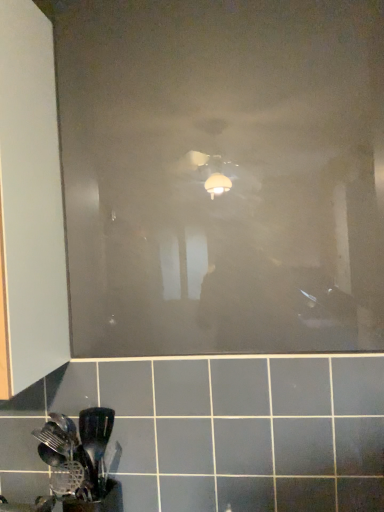
Describe the element at coordinates (76, 455) in the screenshot. The image size is (384, 512). I see `black plastic spatula at lower left` at that location.

Describe the element at coordinates (30, 203) in the screenshot. I see `matte white cabinet at left` at that location.

Where is `transparent matte glass door at center`? transparent matte glass door at center is located at coordinates (222, 174).

Locate an element on the screen. This screenshot has width=384, height=512. black plastic spatula at lower left is located at coordinates (76, 455).

Which is more to the left, matte white cabinet at left or black plastic spatula at lower left?

From the viewer's perspective, matte white cabinet at left appears more on the left side.

Identify the location of cabinetry that is in front of the black plastic spatula at lower left. This screenshot has width=384, height=512. (30, 203).

From a real-world perspective, which object stands above the other?

matte white cabinet at left.

Is matte white cabinet at left placed right next to black plastic spatula at lower left?

matte white cabinet at left and black plastic spatula at lower left are not in contact.

How many degrees apart are the facing directions of matte white cabinet at left and transparent matte glass door at center?

The angular difference between matte white cabinet at left and transparent matte glass door at center is 0.00351 degrees.

Which point is more forward, [54,284] or [340,187]?

Positioned in front is point [340,187].

From a real-world perspective, does matte white cabinet at left stand above transparent matte glass door at center?

No, from a real-world perspective, matte white cabinet at left is not over transparent matte glass door at center

Does matte white cabinet at left appear on the left side of transparent matte glass door at center?

Yes.

Does transparent matte glass door at center have a larger size compared to black plastic spatula at lower left?

Yes.

Is transparent matte glass door at center inside the boundaries of black plastic spatula at lower left, or outside?

transparent matte glass door at center cannot be found inside black plastic spatula at lower left.

In the scene shown: Who is smaller, transparent matte glass door at center or matte white cabinet at left?

With smaller size is transparent matte glass door at center.

The image size is (384, 512). Find the location of `cabinetry lying below the transparent matte glass door at center (from the image's perspective)`. cabinetry lying below the transparent matte glass door at center (from the image's perspective) is located at coordinates (30, 203).

Is transparent matte glass door at center not within matte white cabinet at left?

Indeed, transparent matte glass door at center is completely outside matte white cabinet at left.

From a real-world perspective, is transparent matte glass door at center positioned under matte white cabinet at left based on gravity?

No, from a real-world perspective, transparent matte glass door at center is not under matte white cabinet at left.

Is point (63, 417) in front of point (33, 130)?

No, (63, 417) is further to viewer.

Considering the relative positions of black plastic spatula at lower left and matte white cabinet at left in the image provided, is black plastic spatula at lower left to the left of matte white cabinet at left from the viewer's perspective?

Incorrect, black plastic spatula at lower left is not on the left side of matte white cabinet at left.

Is black plastic spatula at lower left behind matte white cabinet at left?

Yes, the depth of black plastic spatula at lower left is greater than that of matte white cabinet at left.

In the scene shown: Would you consider black plastic spatula at lower left to be distant from matte white cabinet at left?

black plastic spatula at lower left is near matte white cabinet at left, not far away.

At what (x,y) coordinates should I click in order to perform the action: click on glass door above the black plastic spatula at lower left (from the image's perspective). Please return your answer as a coordinate pair (x, y). The image size is (384, 512). Looking at the image, I should click on (222, 174).

Between black plastic spatula at lower left and transparent matte glass door at center, which one has smaller width?

transparent matte glass door at center.

Is transparent matte glass door at center at the back of black plastic spatula at lower left?

No, black plastic spatula at lower left is not facing the opposite direction of transparent matte glass door at center.

Which point is more distant from viewer, (96, 463) or (123, 59)?

The point (96, 463) is farther from the camera.

At what (x,y) coordinates should I click in order to perform the action: click on cabinetry located above the black plastic spatula at lower left (from the image's perspective). Please return your answer as a coordinate pair (x, y). The height and width of the screenshot is (512, 384). Looking at the image, I should click on (30, 203).

The height and width of the screenshot is (512, 384). In the image, there is a transparent matte glass door at center. What are the coordinates of `cabinetry below it (from the image's perspective)` in the screenshot? It's located at (30, 203).

Based on their spatial positions, is matte white cabinet at left or transparent matte glass door at center closer to black plastic spatula at lower left?

matte white cabinet at left lies closer to black plastic spatula at lower left than the other object.

Looking at this image, when comparing their distances from matte white cabinet at left, does black plastic spatula at lower left or transparent matte glass door at center seem closer?

Based on the image, transparent matte glass door at center appears to be nearer to matte white cabinet at left.

Estimate the real-world distances between objects in this image. Which object is further from matte white cabinet at left, transparent matte glass door at center or black plastic spatula at lower left?

Among the two, black plastic spatula at lower left is located further to matte white cabinet at left.

Which object lies further to the anchor point transparent matte glass door at center, matte white cabinet at left or black plastic spatula at lower left?

black plastic spatula at lower left.

Looking at the image, which one is located closer to transparent matte glass door at center, black plastic spatula at lower left or matte white cabinet at left?

matte white cabinet at left is positioned closer to the anchor transparent matte glass door at center.

Based on their spatial positions, is transparent matte glass door at center or matte white cabinet at left further from black plastic spatula at lower left?

Among the two, transparent matte glass door at center is located further to black plastic spatula at lower left.

Where is `cabinetry between transparent matte glass door at center and black plastic spatula at lower left in the vertical direction`? This screenshot has width=384, height=512. cabinetry between transparent matte glass door at center and black plastic spatula at lower left in the vertical direction is located at coordinates (30, 203).